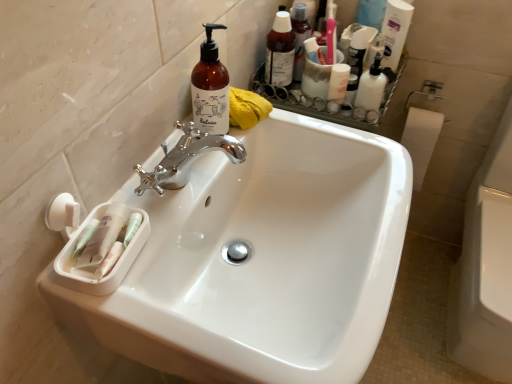
Question: Considering the relative positions of white glossy sink at center and translucent plastic pump bottle at upper right, which is counted as the 1th cleaning product, starting from the right, in the image provided, is white glossy sink at center to the left or to the right of translucent plastic pump bottle at upper right, which is counted as the 1th cleaning product, starting from the right,?

Choices:
 (A) left
 (B) right

Answer: (A)

Question: Considering the positions of point (168, 261) and point (400, 51), is point (168, 261) closer or farther from the camera than point (400, 51)?

Choices:
 (A) closer
 (B) farther

Answer: (A)

Question: Which object is the closest to the translucent plastic pump bottle at upper right, which is counted as the 1th cleaning product, starting from the right?

Choices:
 (A) white glossy lotion at upper right, which is counted as the first toiletry, starting from the right
 (B) white glossy sink at center
 (C) white glossy mouthwash at upper right
 (D) brown glass bottle at upper center, which appears as the second cleaning product when viewed from the right
 (E) white glossy toilet at right

Answer: (A)

Question: Considering the real-world distances, which object is farthest from the white glossy toilet at right?

Choices:
 (A) white glossy lotion at upper right, which is counted as the first toiletry, starting from the right
 (B) translucent plastic bottles at upper right, which ranks as the 2th toiletry in right-to-left order
 (C) translucent plastic pump bottle at upper right, positioned as the 2th cleaning product in left-to-right order
 (D) white glossy mouthwash at upper right
 (E) white glossy sink at center

Answer: (B)